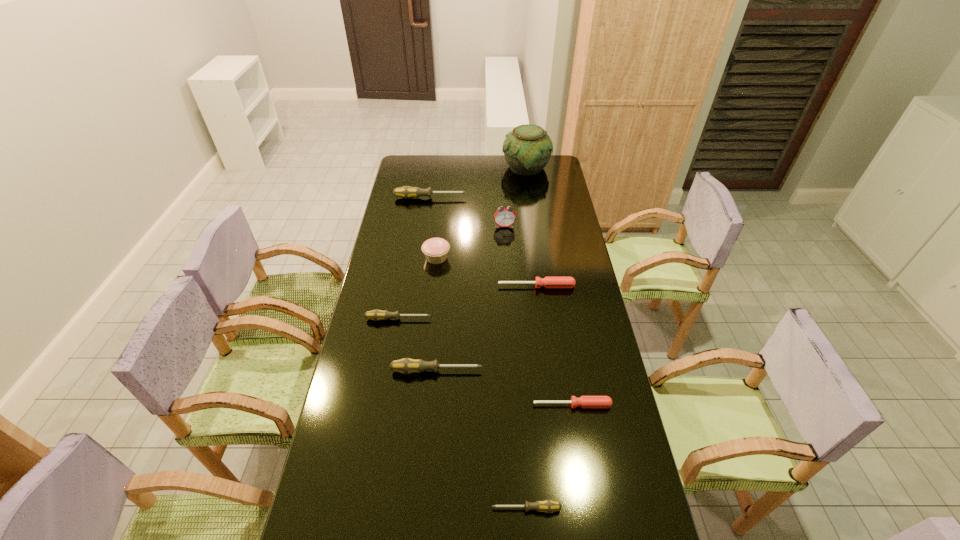
Where is `vacant space located on the right of the sixth nearest object`? vacant space located on the right of the sixth nearest object is located at coordinates (527, 258).

This screenshot has width=960, height=540. Identify the location of free space located at the tip of the farthest gray screwdriver. (495, 198).

At what (x,y) coordinates should I click in order to perform the action: click on blank space located 0.120m at the tip of the fifth tallest object. Please return your answer as a coordinate pair (x, y). The width and height of the screenshot is (960, 540). Looking at the image, I should click on (518, 371).

Where is `vacant position located 0.350m at the tip of the third biggest gray screwdriver`? This screenshot has height=540, width=960. vacant position located 0.350m at the tip of the third biggest gray screwdriver is located at coordinates (527, 319).

Where is `vacant space located 0.260m on the left of the bigger red screwdriver`? vacant space located 0.260m on the left of the bigger red screwdriver is located at coordinates 432,286.

Identify the location of free space located on the front of the second nearest object. Image resolution: width=960 pixels, height=540 pixels. (577, 431).

At what (x,y) coordinates should I click in order to perform the action: click on vacant area situated at the tip of the nearest gray screwdriver. Please return your answer as a coordinate pair (x, y). Image resolution: width=960 pixels, height=540 pixels. Looking at the image, I should click on (361, 509).

You are a GUI agent. You are given a task and a screenshot of the screen. Output one action in this format:
    pyautogui.click(x=<x>, y=<y>)
    Task: Click on the free space located 0.130m at the tip of the nearest gray screwdriver
    The image size is (960, 540).
    Given the screenshot: What is the action you would take?
    pyautogui.click(x=442, y=509)

Where is `free spot located 0.130m at the tip of the nearest gray screwdriver`? The image size is (960, 540). free spot located 0.130m at the tip of the nearest gray screwdriver is located at coordinates (442, 509).

Identify the location of object present at the far edge. (527, 149).